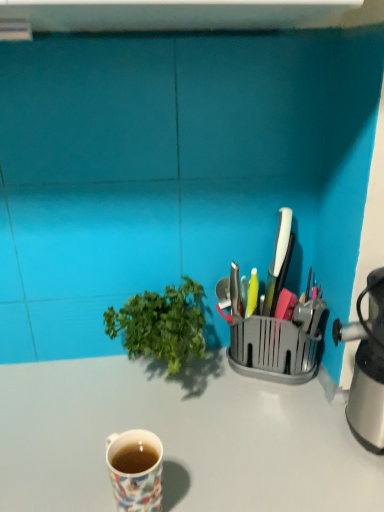
Where is `free location above white glossy desk at center (from a real-world perspective)`? Image resolution: width=384 pixels, height=512 pixels. free location above white glossy desk at center (from a real-world perspective) is located at coordinates (168, 419).